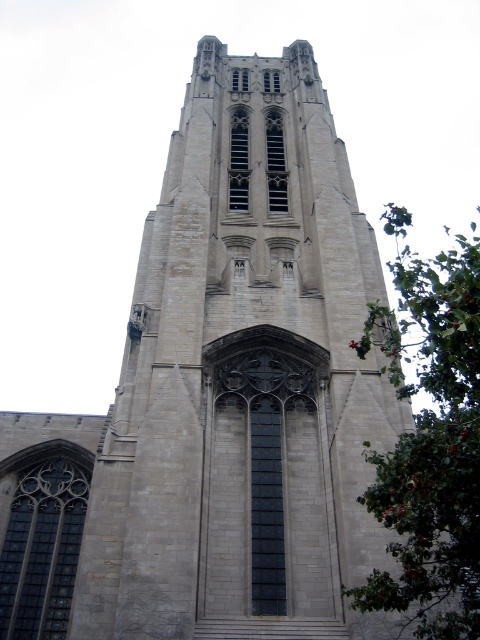
Between point (284, 234) and point (404, 461), which one is positioned behind?

Point (284, 234)

The image size is (480, 640). I want to click on gray stone tower at center, so click(242, 380).